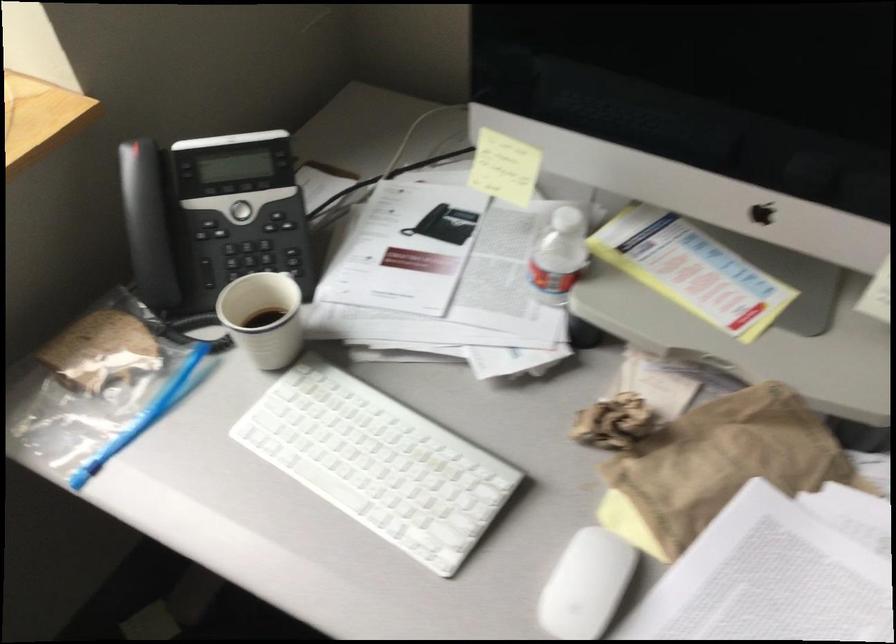
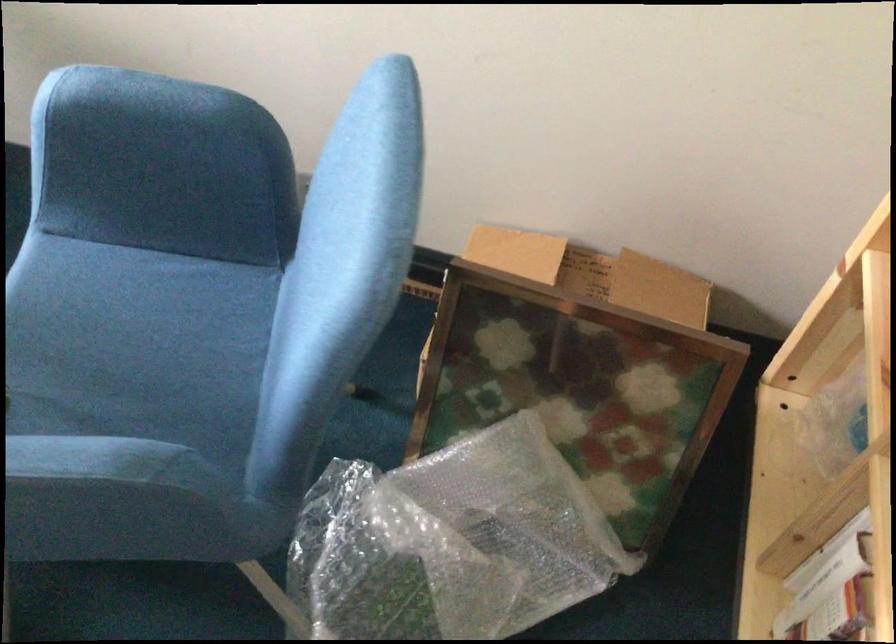
The images are taken continuously from a first-person perspective. In which direction are you moving?

The cameraman moved toward right, backward.